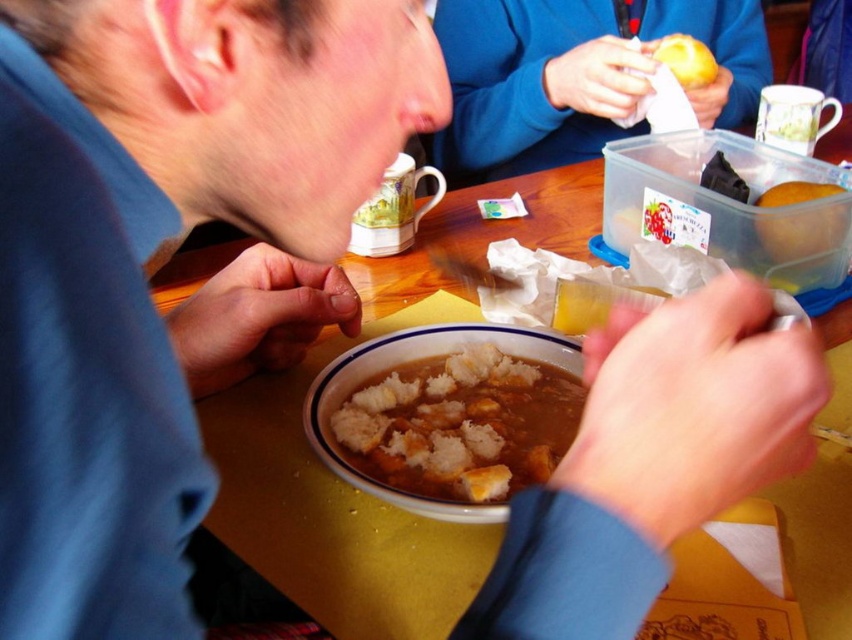
Question: Which point is closer to the camera taking this photo?

Choices:
 (A) (375, 458)
 (B) (761, 10)
 (C) (680, 61)

Answer: (A)

Question: Can you confirm if clear plastic container at upper right is positioned below yellow matte apple at upper center?

Choices:
 (A) no
 (B) yes

Answer: (B)

Question: Can you confirm if matte plastic container at upper center is thinner than yellow matte apple at upper center?

Choices:
 (A) no
 (B) yes

Answer: (A)

Question: Among these objects, which one is nearest to the camera?

Choices:
 (A) clear plastic container at upper right
 (B) brown crumbly bread at center
 (C) yellow matte apple at upper center

Answer: (B)

Question: Which point appears closest to the camera in this image?

Choices:
 (A) (694, 54)
 (B) (527, 406)
 (C) (573, 209)

Answer: (B)

Question: Does matte plastic container at upper center have a smaller size compared to yellow matte apple at upper center?

Choices:
 (A) no
 (B) yes

Answer: (A)